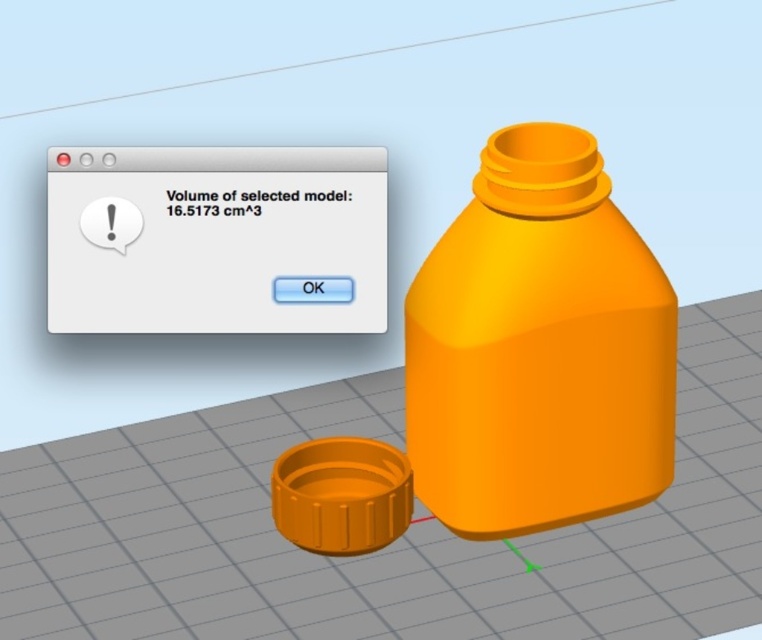
Wait, the objects list has two entries that are almost identical. The first is orange matte plastic bottle at center and the second is matte orange plastic bottle at center. The difference is the order of the adjectives. Since the rules say to use the object labels exactly as given, I need to make sure both are included in the question. But the objects description says the first is closer than the second. Hmm, but how can two identical bottles be at the same center but different distances? Maybe it was a ty

The orange matte plastic bottle at center is closer to the viewer than the matte orange plastic bottle at center, so the former appears in front of the latter in the image.

You are an engineer designing a storage container. You have two options in the image, the orange matte plastic bottle at center and the matte orange plastic bottle at center. Which one is taller?

The orange matte plastic bottle at center is much taller than the matte orange plastic bottle at center according to the description.

You are a 3D designer working in a digital workspace. You need to place the orange matte plastic bottle at center precisely at the origin point of the coordinate system. Currently, it is located at point 0.544, 0.707. What adjustment should you make to its position to move it to the origin?

To move the orange matte plastic bottle at center to the origin point, you need to subtract 0.544 from its x coordinate and subtract 0.707 from its y coordinate, bringing it to the origin point at (0, 0).